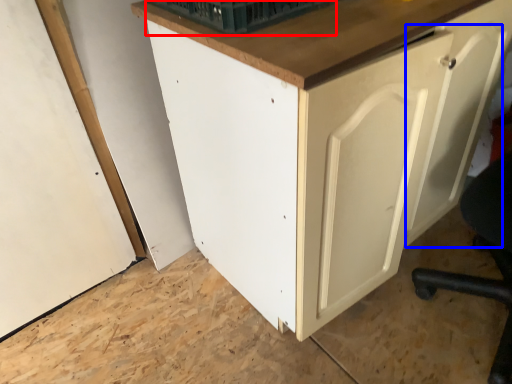
Question: Which of the following is the farthest to the observer, basket (highlighted by a red box) or door (highlighted by a blue box)?

Choices:
 (A) basket
 (B) door

Answer: (A)